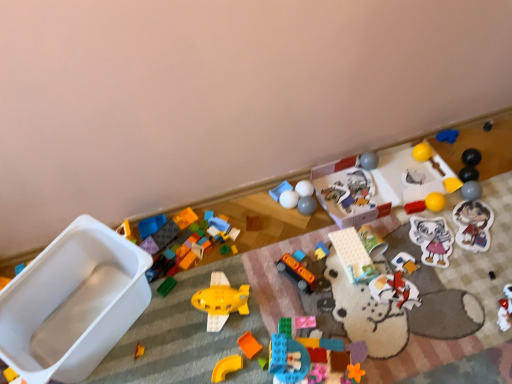
The width and height of the screenshot is (512, 384). What are the coordinates of `vacant space positioned to the left of yellow matte square at center-right, which is the 4th toy in right-to-left order` in the screenshot? It's located at (414, 210).